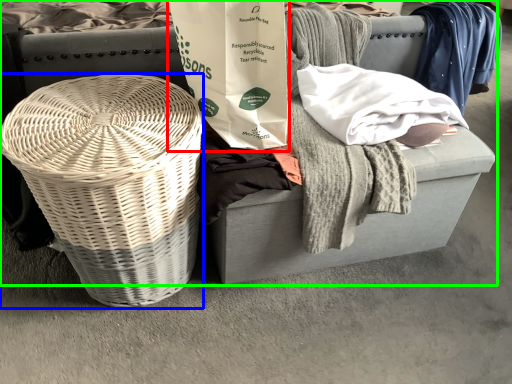
Question: Which object is positioned farthest from shopping bag (highlighted by a red box)? Select from basket (highlighted by a blue box) and furniture (highlighted by a green box).

Choices:
 (A) basket
 (B) furniture

Answer: (B)